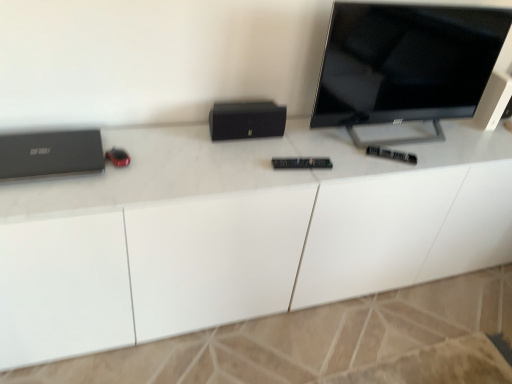
The height and width of the screenshot is (384, 512). What do you see at coordinates (406, 65) in the screenshot? I see `black glossy tv at upper right` at bounding box center [406, 65].

Locate an element on the screen. The image size is (512, 384). black matte speaker at upper right is located at coordinates (493, 101).

Measure the distance between matte black laptop at left and camera.

matte black laptop at left is 4.17 feet away from camera.

The width and height of the screenshot is (512, 384). Identify the location of black glossy tv at upper right. (x=406, y=65).

Is point (284, 109) in front of point (387, 154)?

That is False.

Is black matte speaker at center not near black plastic remote at center?

Actually, black matte speaker at center and black plastic remote at center are a little close together.

Is black matte speaker at center not inside black plastic remote at center?

Yes, black matte speaker at center is not within black plastic remote at center.

What's the angular difference between black glossy tv at upper right and white glossy desk at center's facing directions?

The angle between the facing direction of black glossy tv at upper right and the facing direction of white glossy desk at center is 0.000123 degrees.

Is black glossy tv at upper right placed right next to white glossy desk at center?

No, black glossy tv at upper right is not touching white glossy desk at center.

From a real-world perspective, between black glossy tv at upper right and white glossy desk at center, who is vertically higher?

black glossy tv at upper right.

From the image's perspective, is black glossy tv at upper right located above white glossy desk at center?

Yes.

Is white glossy desk at center at the left side of black matte speaker at upper right?

Indeed, white glossy desk at center is positioned on the left side of black matte speaker at upper right.

Is white glossy desk at center bigger or smaller than black matte speaker at upper right?

Clearly, white glossy desk at center is larger in size than black matte speaker at upper right.

Between white glossy desk at center and black matte speaker at upper right, which one has larger width?

white glossy desk at center.

Measure the distance from white glossy desk at center to black matte speaker at upper right.

white glossy desk at center is 35.19 inches away from black matte speaker at upper right.

Is matte black laptop at left directly adjacent to black matte speaker at center?

No, matte black laptop at left is not touching black matte speaker at center.

From the image's perspective, is matte black laptop at left located beneath black matte speaker at center?

Yes, from the image's perspective, matte black laptop at left is below black matte speaker at center.

Is matte black laptop at left smaller than black matte speaker at center?

Indeed, matte black laptop at left has a smaller size compared to black matte speaker at center.

Looking at their sizes, would you say matte black laptop at left is wider or thinner than black matte speaker at center?

Considering their sizes, matte black laptop at left looks broader than black matte speaker at center.

From a real-world perspective, which is physically below, black matte speaker at upper right or black plastic remote at center?

black plastic remote at center.

Consider the image. Would you say black matte speaker at upper right is outside black plastic remote at center?

Yes.

Is black matte speaker at upper right smaller than black plastic remote at center?

No, black matte speaker at upper right is not smaller than black plastic remote at center.

Is white glossy desk at center next to black glossy tv at upper right?

white glossy desk at center and black glossy tv at upper right are not in contact.

From the image's perspective, does white glossy desk at center appear lower than black glossy tv at upper right?

Yes, from the image's perspective, white glossy desk at center is beneath black glossy tv at upper right.

Considering the sizes of objects white glossy desk at center and black glossy tv at upper right in the image provided, who is shorter, white glossy desk at center or black glossy tv at upper right?

With less height is black glossy tv at upper right.

Considering the positions of points (404, 101) and (486, 124), is point (404, 101) closer to camera compared to point (486, 124)?

Yes, point (404, 101) is closer to viewer.

In the scene shown: Which is more to the right, black glossy tv at upper right or black matte speaker at upper right?

Positioned to the right is black matte speaker at upper right.

From a real-world perspective, between black glossy tv at upper right and black matte speaker at upper right, who is vertically lower?

black matte speaker at upper right, from a real-world perspective.

Does black glossy tv at upper right turn towards black matte speaker at upper right?

No, black glossy tv at upper right is not aimed at black matte speaker at upper right.

I want to click on control that is behind the black matte speaker at center, so click(391, 154).

This screenshot has height=384, width=512. Find the location of `television positioned vertically above the white glossy desk at center (from a real-world perspective)`. television positioned vertically above the white glossy desk at center (from a real-world perspective) is located at coordinates (406, 65).

Based on their spatial positions, is white glossy desk at center or black matte speaker at upper right closer to matte black laptop at left?

The object closer to matte black laptop at left is white glossy desk at center.

Looking at this image, considering their positions, is white glossy desk at center positioned closer to matte black laptop at left than black glossy tv at upper right?

Among the two, white glossy desk at center is located nearer to matte black laptop at left.

When comparing their distances from matte black laptop at left, does black plastic remote at center or black matte speaker at center seem further?

black plastic remote at center lies further to matte black laptop at left than the other object.

Based on their spatial positions, is matte black laptop at left or black glossy tv at upper right further from black plastic remote at center?

Based on the image, matte black laptop at left appears to be further to black plastic remote at center.

Looking at the image, which one is located further to white glossy desk at center, black glossy tv at upper right or black matte speaker at center?

Based on the image, black matte speaker at center appears to be further to white glossy desk at center.

Looking at the image, which one is located closer to black glossy tv at upper right, matte black laptop at left or black matte speaker at center?

Based on the image, black matte speaker at center appears to be nearer to black glossy tv at upper right.

Considering their positions, is black matte speaker at center positioned closer to black glossy tv at upper right than black matte speaker at upper right?

black matte speaker at upper right lies closer to black glossy tv at upper right than the other object.

Consider the image. Based on their spatial positions, is matte black laptop at left or black plastic remote at center further from white glossy desk at center?

black plastic remote at center is positioned further to the anchor white glossy desk at center.

Find the location of a particular element. The image size is (512, 384). television positioned between white glossy desk at center and black matte speaker at upper right from near to far is located at coordinates (406, 65).

Image resolution: width=512 pixels, height=384 pixels. I want to click on computer between matte black laptop at left and white glossy desk at center, so click(x=246, y=120).

Locate an element on the screen. The width and height of the screenshot is (512, 384). control between black glossy tv at upper right and white glossy desk at center in the vertical direction is located at coordinates (391, 154).

The image size is (512, 384). I want to click on control situated between matte black laptop at left and black matte speaker at upper right from left to right, so click(391, 154).